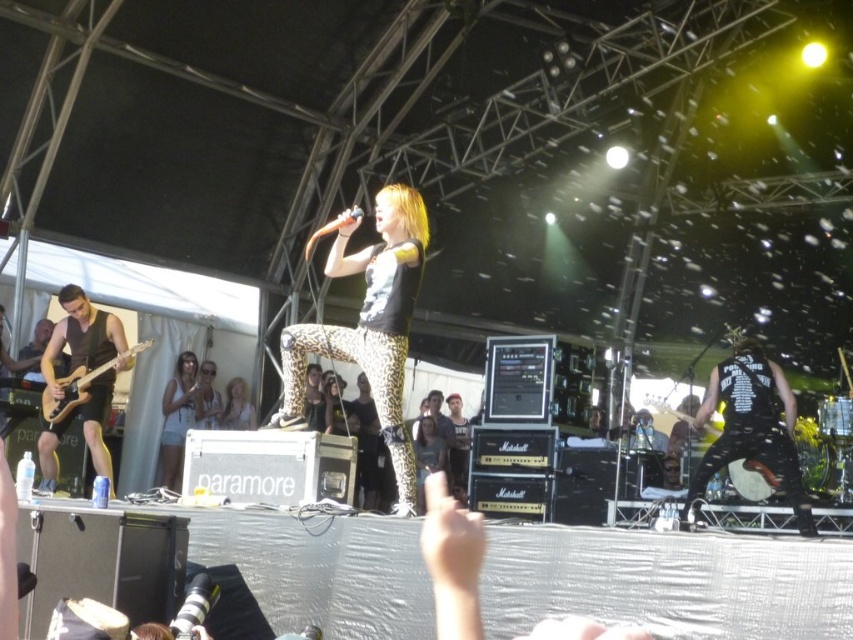
You are a photographer at the concert venue and want to capture a photo that includes both the white leopard print pants at center and the wooden drum at right. Based on their positions, which object should appear higher in the photo?

The white leopard print pants at center should appear higher in the photo since it is located above the wooden drum at right.

You are a photographer at the concert venue. You need to capture a photo that includes both the matte brown electric guitar at left and the leopard print pants at center. Based on their positions, which object should you focus on first to ensure both are in the frame?

The matte brown electric guitar at left is positioned over the leopard print pants at center, so you should focus on the leopard print pants at center first to ensure both are visible in the frame.